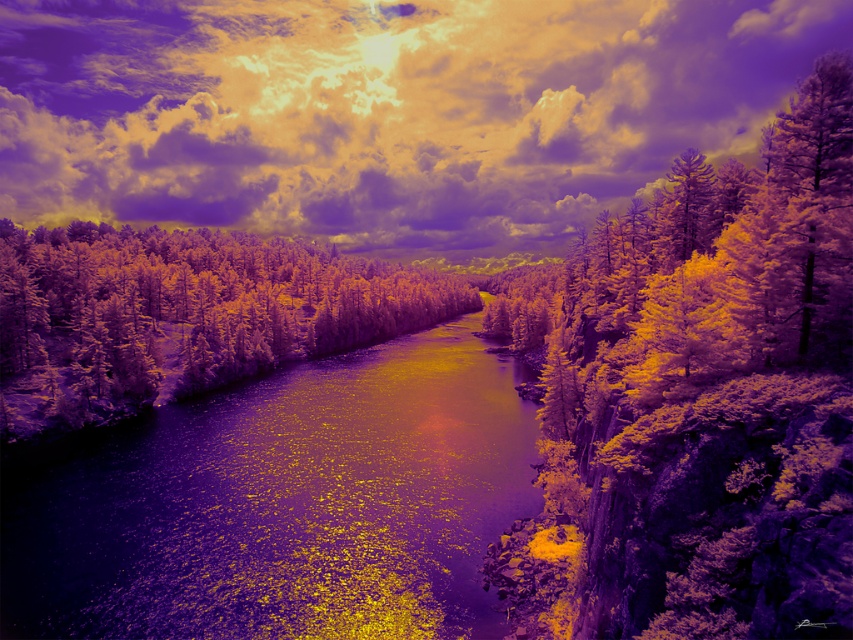
Measure the distance from shiny metallic river at center to green matte trees at center.

shiny metallic river at center and green matte trees at center are 101.75 meters apart from each other.

Measure the distance between shiny metallic river at center and camera.

The distance of shiny metallic river at center from camera is 30.47 meters.

Is point (201, 488) behind point (378, 268)?

No, (201, 488) is in front of (378, 268).

This screenshot has width=853, height=640. Identify the location of shiny metallic river at center. (286, 506).

Is point (483, 17) more distant than point (433, 291)?

Yes, point (483, 17) is farther from viewer.

Is point (206, 97) behind point (96, 326)?

Yes, it is.

This screenshot has width=853, height=640. In order to click on cloudy sky at upper center in this screenshot , I will do `click(384, 112)`.

Can you confirm if purple textured tree at right is positioned below shiny metallic river at center?

Incorrect, purple textured tree at right is not positioned below shiny metallic river at center.

Between point (576, 291) and point (152, 515), which one is positioned behind?

The point (576, 291) is behind.

Is point (671, 241) in front of point (22, 570)?

No.

In order to click on purple textured tree at right in this screenshot , I will do `click(695, 400)`.